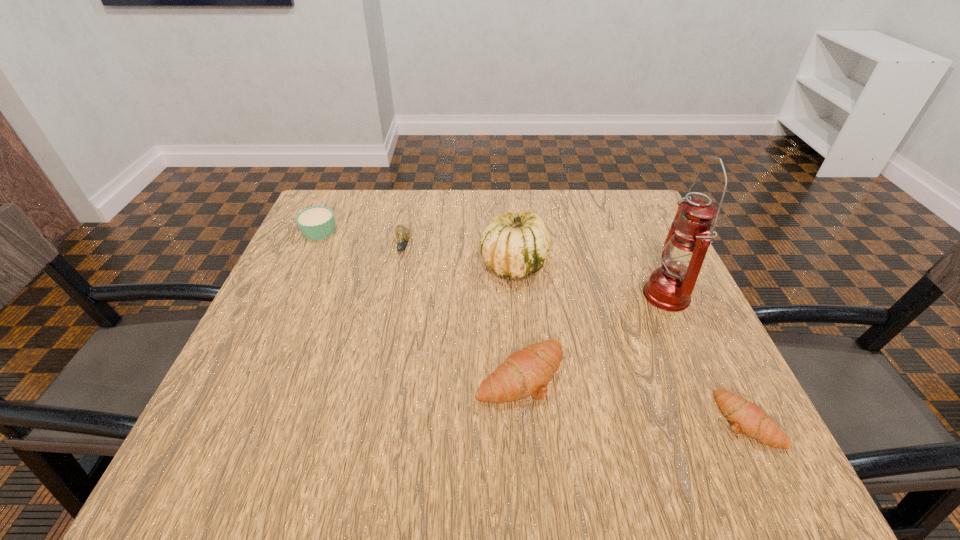
Identify the location of the left crescent roll. (526, 372).

The width and height of the screenshot is (960, 540). I want to click on the shorter crescent roll, so click(745, 416).

This screenshot has width=960, height=540. What are the coordinates of `the right crescent roll` in the screenshot? It's located at (745, 416).

The image size is (960, 540). In order to click on cupcake in this screenshot , I will do `click(317, 222)`.

Where is `the second tallest object`? The width and height of the screenshot is (960, 540). the second tallest object is located at coordinates (516, 245).

At what (x,y) coordinates should I click in order to perform the action: click on oil lamp. Please return your answer as a coordinate pair (x, y). Looking at the image, I should click on (669, 288).

You are a GUI agent. You are given a task and a screenshot of the screen. Output one action in this format:
    pyautogui.click(x=<x>, y=<y>)
    Task: Click on the escargot
    
    Given the screenshot: What is the action you would take?
    pyautogui.click(x=403, y=233)

Locate an element on the screen. free point located 0.070m on the back of the left crescent roll is located at coordinates (516, 318).

The width and height of the screenshot is (960, 540). I want to click on vacant space located on the back of the shortest object, so click(673, 268).

In order to click on vacant region located 0.290m on the front of the cupcake in this screenshot , I will do `click(274, 331)`.